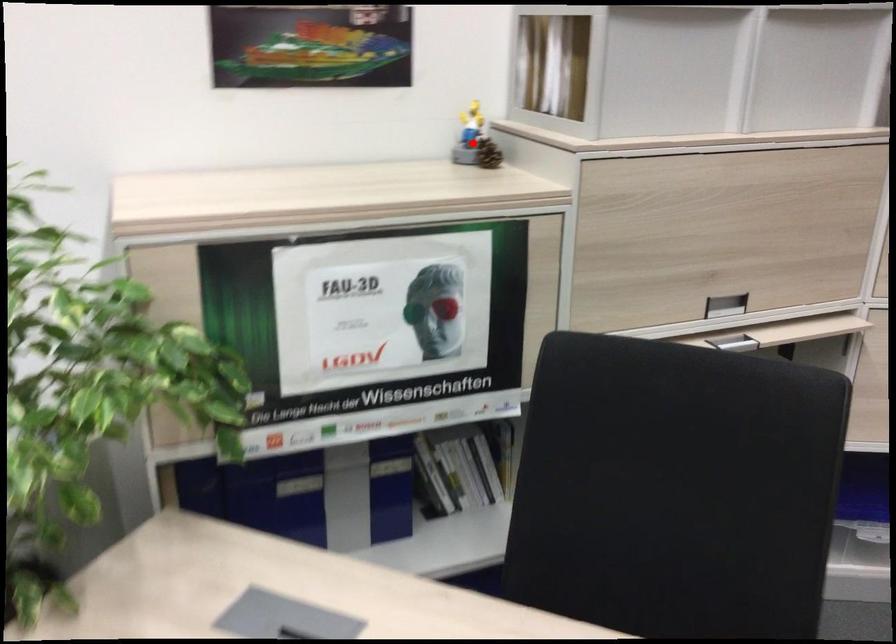
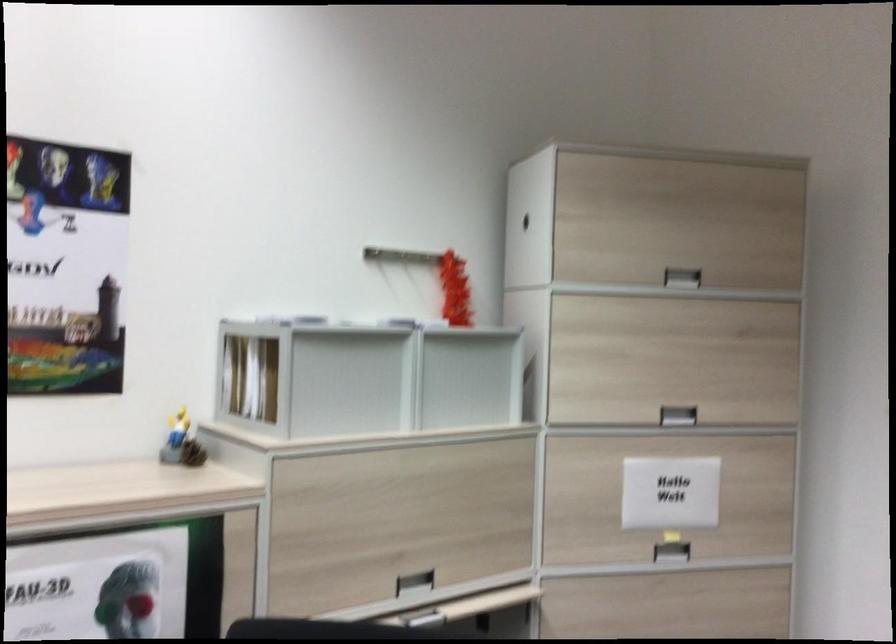
Locate, in the second image, the point that corresponds to the highlighted location in the first image.

(181, 442)